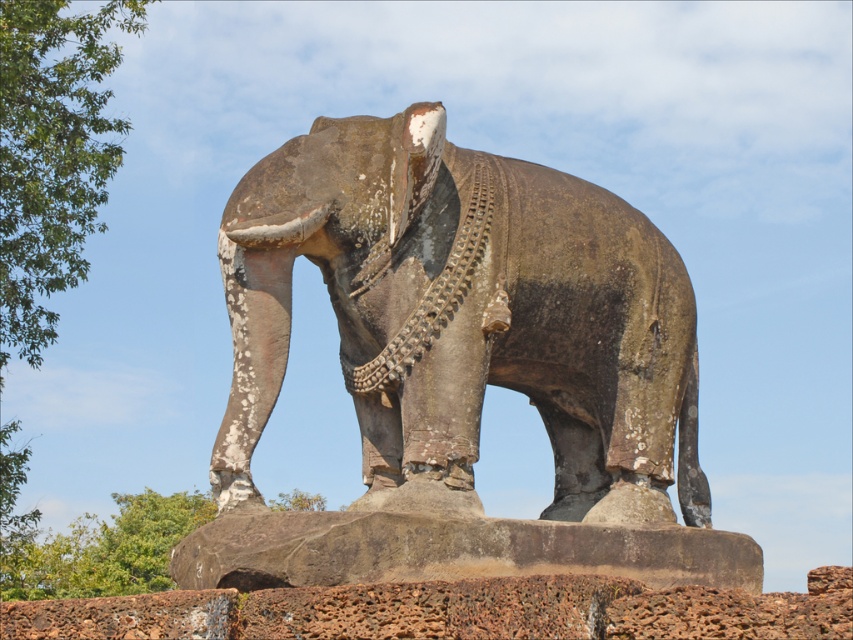
Between rusty stone elephant at center and green leafy tree at upper left, which one appears on the right side from the viewer's perspective?

rusty stone elephant at center

Describe the element at coordinates (463, 317) in the screenshot. This screenshot has height=640, width=853. I see `rusty stone elephant at center` at that location.

Who is more forward, (552,264) or (3,83)?

Point (552,264)

The width and height of the screenshot is (853, 640). I want to click on rusty stone elephant at center, so click(463, 317).